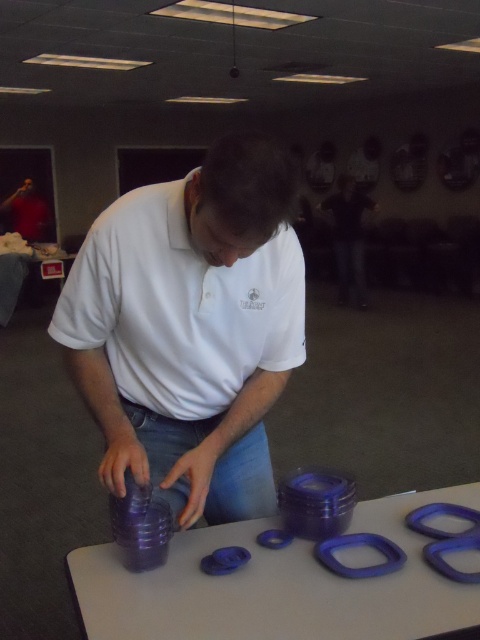
From the picture: You are a fashion designer observing the man in the scene. You need to determine if the purple plastic rings at center can be worn as accessories on the white matte shirt at center without overlapping. Based on their sizes, what is your conclusion?

The white matte shirt at center has a larger size compared to purple plastic rings at center, so the purple plastic rings at center can be worn as accessories on the white matte shirt at center without overlapping.

You are a delivery person who needs to place a large package on the table where the purple plastic rings at center and the matte white shirt at center are located. Which object on the table should you move to make space, and why?

You should move the purple plastic rings at center because it is smaller than the matte white shirt at center and thus easier to relocate to make space for the large package.